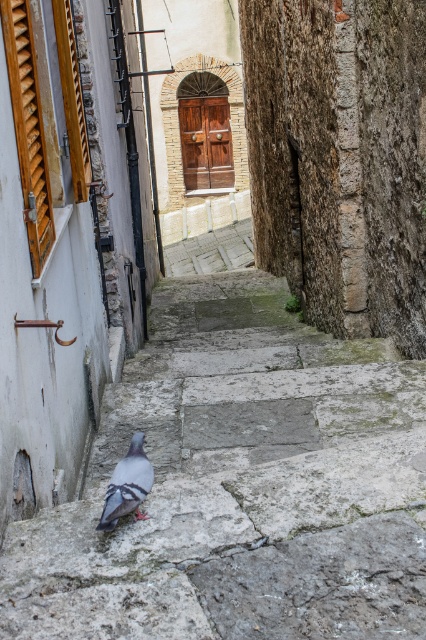
Is gray stone stairs at center above gray matte pigeon at lower center?

Yes, gray stone stairs at center is above gray matte pigeon at lower center.

Between point (317, 596) and point (141, 472), which one is positioned in front?

Point (317, 596) is more forward.

This screenshot has width=426, height=640. I want to click on gray stone stairs at center, so click(x=239, y=486).